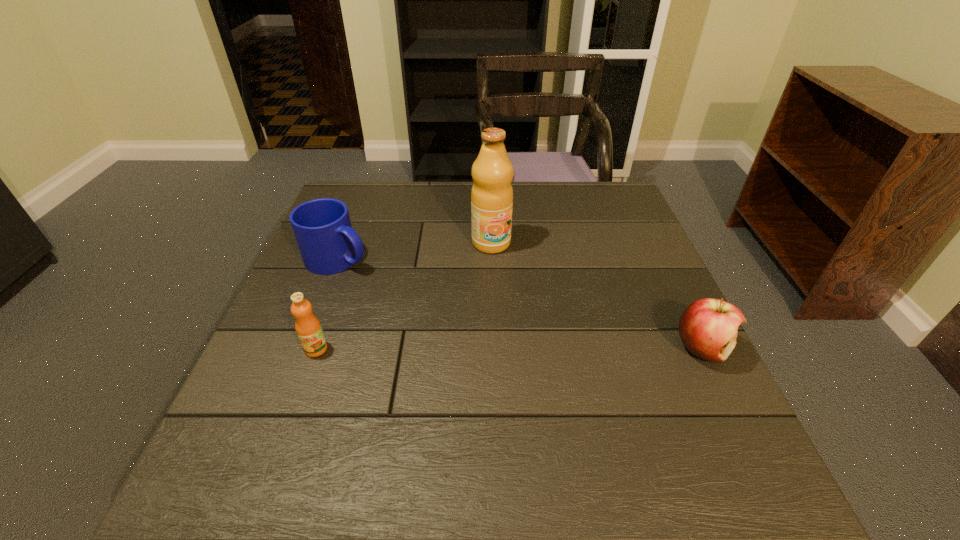
Locate an element on the screen. vacant spot on the desktop that is between the orange juice and the apple and is positioned on the front label of the third object from left to right is located at coordinates (561, 348).

This screenshot has height=540, width=960. I want to click on vacant space on the desktop that is between the orange juice and the rightmost object and is positioned on the side with the handle of the mug, so click(x=534, y=348).